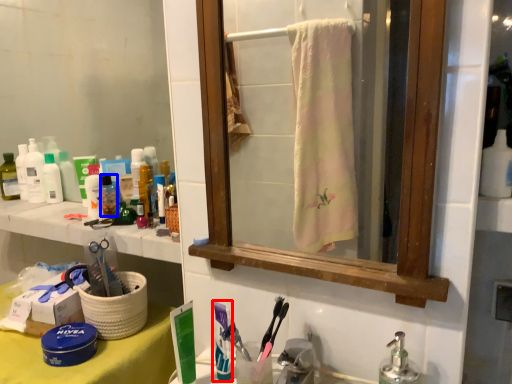
Question: Which point is further to the camera, toothpaste (highlighted by a red box) or mouthwash (highlighted by a blue box)?

Choices:
 (A) toothpaste
 (B) mouthwash

Answer: (B)